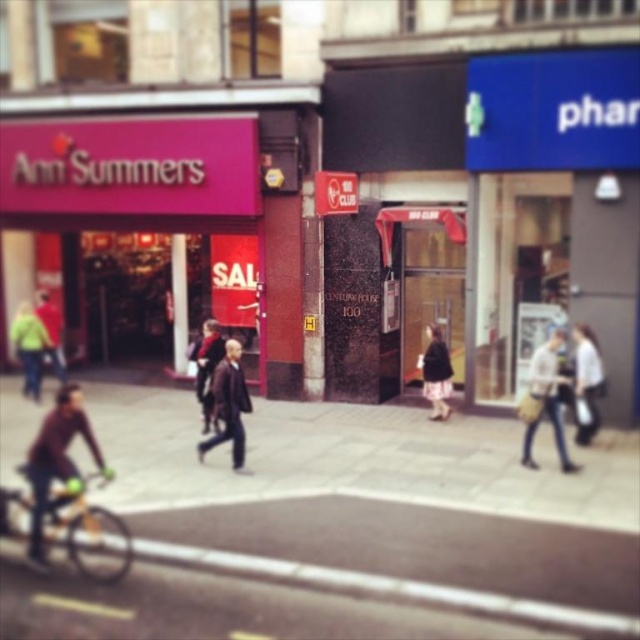
You are a delivery person who needs to place a package on the smooth concrete pavement at center. However, there is a green fabric jacket at left nearby. Which object is lower in position so you can safely place the package there?

The smooth concrete pavement at center is located below green fabric jacket at left, so you can safely place the package on the smooth concrete pavement at center since it is lower.